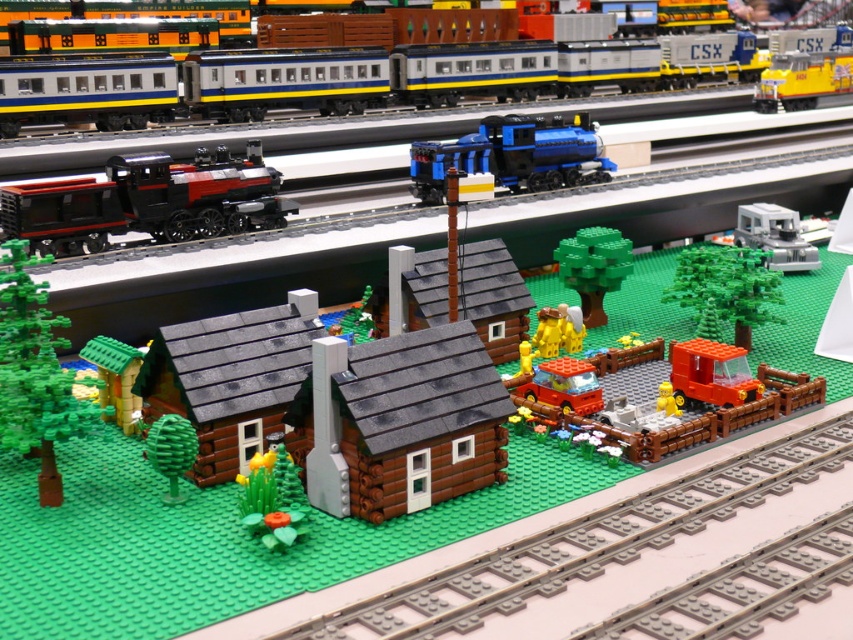
Can you confirm if black matte train at left is positioned to the left of blue metallic train at center?

Correct, you'll find black matte train at left to the left of blue metallic train at center.

You are a GUI agent. You are given a task and a screenshot of the screen. Output one action in this format:
    pyautogui.click(x=<x>, y=<y>)
    Task: Click on the black matte train at left
    The height and width of the screenshot is (640, 853).
    Given the screenshot: What is the action you would take?
    pyautogui.click(x=148, y=202)

Is point (45, 211) positioned behind point (515, 140)?

No.

Image resolution: width=853 pixels, height=640 pixels. Identify the location of black matte train at left. 148,202.

Is point (509, 604) closer to viewer compared to point (618, 81)?

Yes.

Identify the location of brown wooden train track at lower center. Image resolution: width=853 pixels, height=640 pixels. (616, 545).

Which is behind, point (401, 604) or point (360, 52)?

Positioned behind is point (360, 52).

You are a GUI agent. You are given a task and a screenshot of the screen. Output one action in this format:
    pyautogui.click(x=<x>, y=<y>)
    Task: Click on the brown wooden train track at lower center
    The height and width of the screenshot is (640, 853).
    Given the screenshot: What is the action you would take?
    pyautogui.click(x=616, y=545)

Between brushed metal train at upper center and blue metallic train at center, which one appears on the right side from the viewer's perspective?

From the viewer's perspective, blue metallic train at center appears more on the right side.

Can you confirm if brushed metal train at upper center is positioned to the left of blue metallic train at center?

Yes, brushed metal train at upper center is to the left of blue metallic train at center.

The width and height of the screenshot is (853, 640). Identify the location of brushed metal train at upper center. (433, 74).

The image size is (853, 640). What are the coordinates of `brushed metal train at upper center` in the screenshot? It's located at (433, 74).